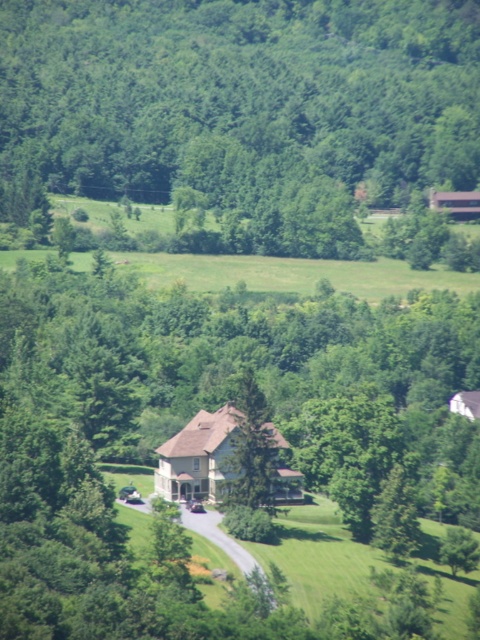
Question: Is green leafy tree at upper center to the left of green textured tree at center from the viewer's perspective?

Choices:
 (A) yes
 (B) no

Answer: (A)

Question: Where is green leafy tree at upper center located in relation to green textured tree at center in the image?

Choices:
 (A) left
 (B) right

Answer: (A)

Question: Does green leafy tree at upper center appear on the right side of green textured tree at center?

Choices:
 (A) yes
 (B) no

Answer: (B)